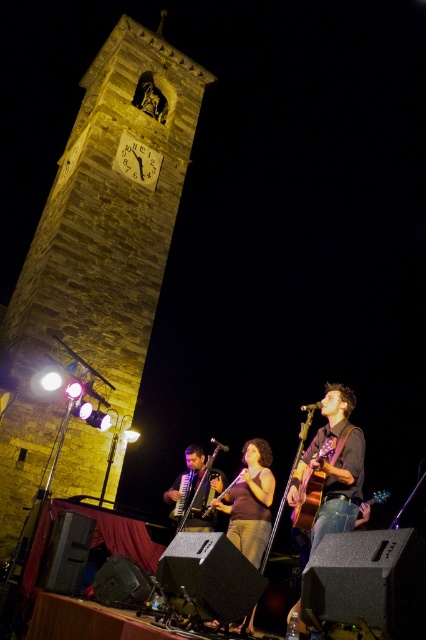
Question: Is brown fabric dress at center to the left of matte brown accordion at lower center from the viewer's perspective?

Choices:
 (A) yes
 (B) no

Answer: (B)

Question: Which object is closer to the camera taking this photo?

Choices:
 (A) brown fabric dress at center
 (B) wooden acoustic guitar at center
 (C) denim jeans at center

Answer: (A)

Question: Which of the following is the closest to the observer?

Choices:
 (A) (302, 520)
 (B) (298, 476)

Answer: (A)

Question: Can you confirm if stone clock tower at upper left is positioned above brown fabric dress at center?

Choices:
 (A) no
 (B) yes

Answer: (B)

Question: Does brown fabric dress at center appear under matte brown accordion at lower center?

Choices:
 (A) yes
 (B) no

Answer: (B)

Question: Which of these objects is positioned farthest from the brown fabric dress at center?

Choices:
 (A) matte brown accordion at lower center
 (B) denim jeans at center
 (C) matte brown guitar at center
 (D) stone clock tower at upper left

Answer: (D)